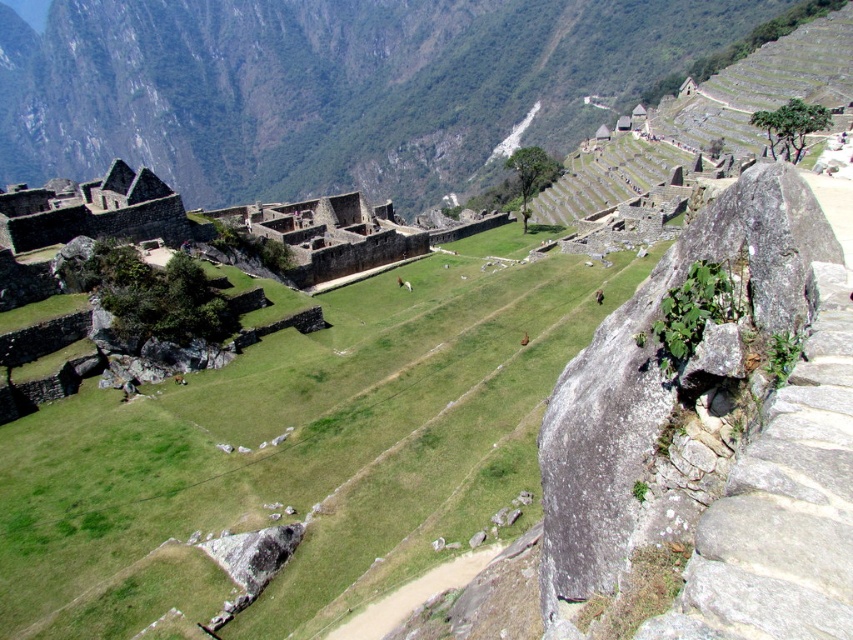
Does point (177, 605) come in front of point (498, 38)?

Yes, point (177, 605) is in front of point (498, 38).

Is point (161, 419) farther from camera compared to point (352, 182)?

No, it is in front of (352, 182).

Is point (86, 467) positioned in front of point (712, 20)?

Yes, point (86, 467) is in front of point (712, 20).

The width and height of the screenshot is (853, 640). What are the coordinates of `green grassy at center` in the screenshot? It's located at (296, 451).